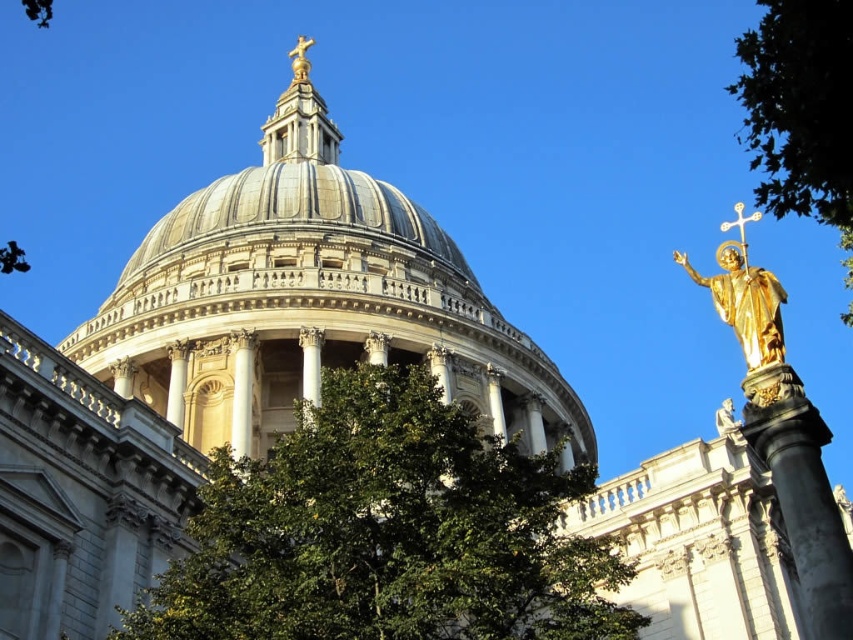
You are a visitor standing in front of the grand dome structure. You notice the green leafy tree at center and the gold metallic statue at top. Which object is wider?

The green leafy tree at center is wider than the gold metallic statue at top.

You are an architect analyzing the symmetry of the building. Which object, the gold metallic statue at top or the metallic gold cross at upper right, is positioned to the left when viewed from the front?

The gold metallic statue at top is positioned to the left of the metallic gold cross at upper right.